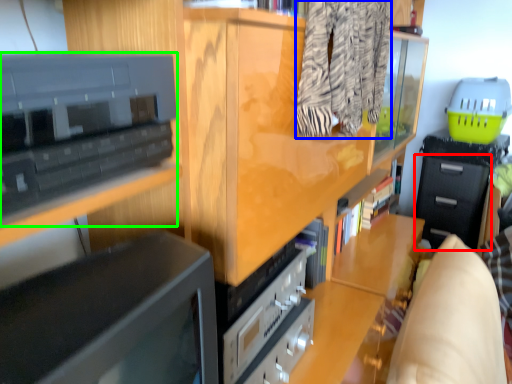
Question: Which object is the farthest from drawer (highlighted by a red box)? Choose among these: clothing (highlighted by a blue box) or cabinetry (highlighted by a green box).

Choices:
 (A) clothing
 (B) cabinetry

Answer: (B)